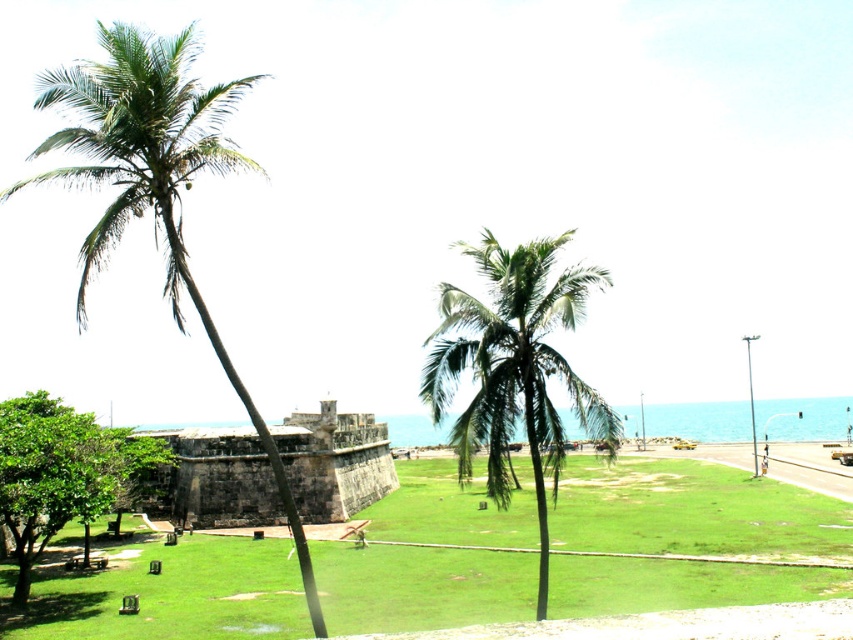
Looking at this image, you are standing at the point marked as point (428, 560) in the image. What is the name of the object you are currently standing on?

The point (428, 560) corresponds to the green grassy area at center, so you are standing on the green grassy area at center.

You are a tourist standing at the base of the green leafy palm tree at left. You want to take a photo of the stone fortification in the middle ground. Since the palm tree might block your view, can you step back enough to avoid the tree blocking the fortification in your photo? The camera you are using has a standard 50mm lens.

The green leafy palm tree at left is 44.98 meters away from the viewer. To avoid the tree blocking the fortification, you need to step back further than 44.98 meters. However, since the fortification is in the middle ground, stepping back might place you too far to capture it clearly. Consider moving to the side instead of directly backward to frame the shot without obstruction.